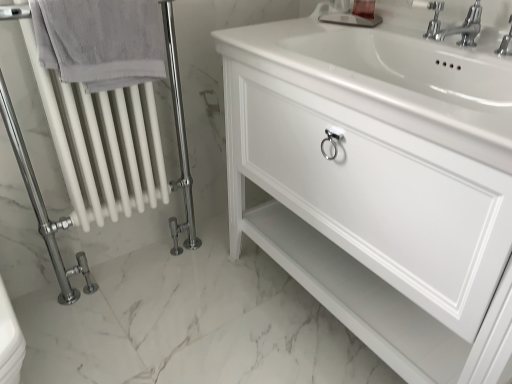
At what (x,y) coordinates should I click in order to perform the action: click on vacant space behind clear plastic soap at upper center. Please return your answer as a coordinate pair (x, y). The width and height of the screenshot is (512, 384). Looking at the image, I should click on (350, 15).